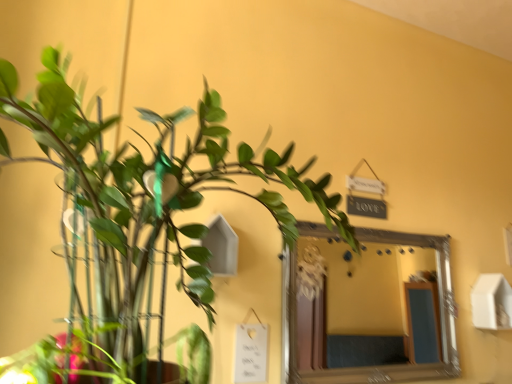
Identify the location of wooden frame mirror at center. This screenshot has height=384, width=512. (364, 305).

Describe the element at coordinates (364, 305) in the screenshot. I see `wooden frame mirror at center` at that location.

Measure the distance between point [409,317] and camera.

Point [409,317] is 4.88 meters away from camera.

Locate an element on the screen. The height and width of the screenshot is (384, 512). wooden frame mirror at center is located at coordinates (364, 305).